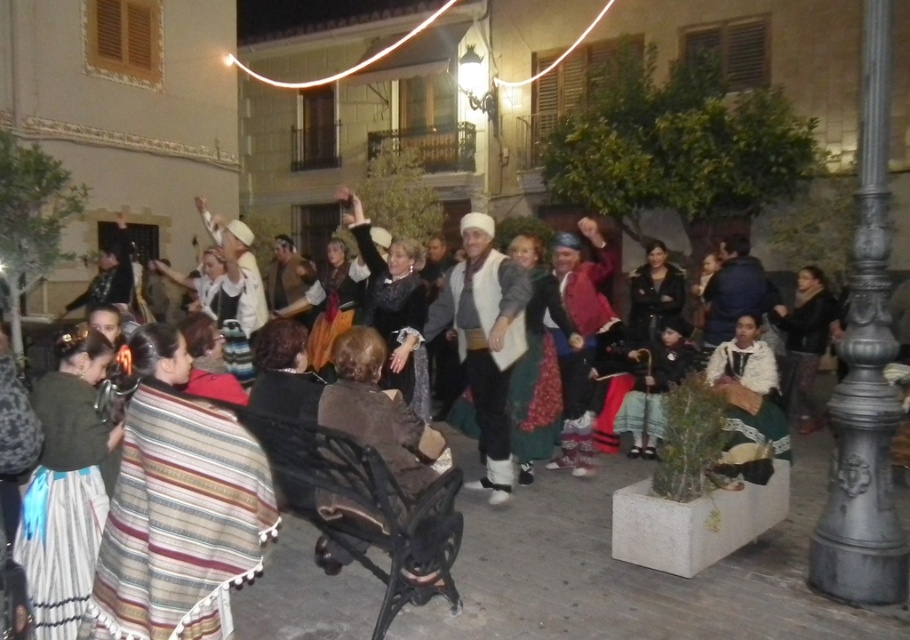
Is matte black dress at center bigger than white lace dress at lower right?

Yes, matte black dress at center is bigger than white lace dress at lower right.

Describe the element at coordinates (623, 570) in the screenshot. I see `matte black dress at center` at that location.

You are a GUI agent. You are given a task and a screenshot of the screen. Output one action in this format:
    pyautogui.click(x=<x>, y=<y>)
    Task: Click on the matte black dress at center
    
    Given the screenshot: What is the action you would take?
    pyautogui.click(x=623, y=570)

Can you confirm if matte black dress at center is positioned to the left of white woolen sweater at center?

Incorrect, matte black dress at center is not on the left side of white woolen sweater at center.

Between point (500, 605) and point (500, 412), which one is positioned behind?

Positioned behind is point (500, 412).

Describe the element at coordinates (623, 570) in the screenshot. I see `matte black dress at center` at that location.

Locate an element on the screen. This screenshot has height=640, width=910. matte black dress at center is located at coordinates (623, 570).

Consider the image. Can you confirm if white woolen sweater at center is positioned to the right of white lace dress at lower right?

In fact, white woolen sweater at center is to the left of white lace dress at lower right.

Does point (521, 344) come behind point (734, 404)?

That is False.

Is point (502, 340) positioned before point (764, 396)?

Yes, it is in front of point (764, 396).

Where is `white woolen sweater at center`? The width and height of the screenshot is (910, 640). white woolen sweater at center is located at coordinates (484, 340).